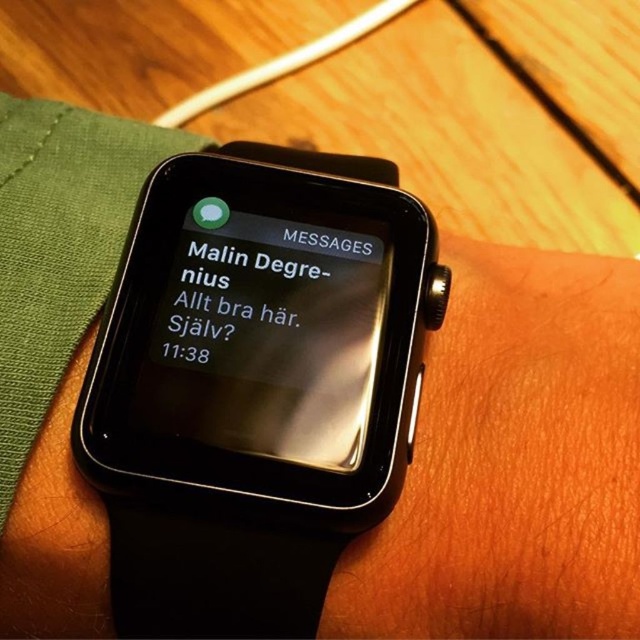
In the scene shown: Who is more distant from viewer, (115, 513) or (321, 467)?

The point (321, 467) is behind.

Does black matte smartwatch at center have a lesser width compared to black glass watch face at center?

No, black matte smartwatch at center is not thinner than black glass watch face at center.

In order to click on black matte smartwatch at center in this screenshot , I will do `click(253, 385)`.

Can you confirm if black glass watch face at center is bigger than black glossy watch face at center?

Correct, black glass watch face at center is larger in size than black glossy watch face at center.

Based on the photo, who is more distant from viewer, (358, 308) or (243, 330)?

Positioned behind is point (358, 308).

Locate an element on the screen. Image resolution: width=640 pixels, height=640 pixels. black glass watch face at center is located at coordinates (264, 339).

Can you confirm if black matte smartwatch at center is positioned above black glossy watch face at center?

No.

Is point (336, 166) positioned behind point (220, 321)?

Yes, it is.

Who is more distant from viewer, (120,342) or (298,264)?

The point (298,264) is behind.

The image size is (640, 640). In order to click on black matte smartwatch at center in this screenshot , I will do `click(253, 385)`.